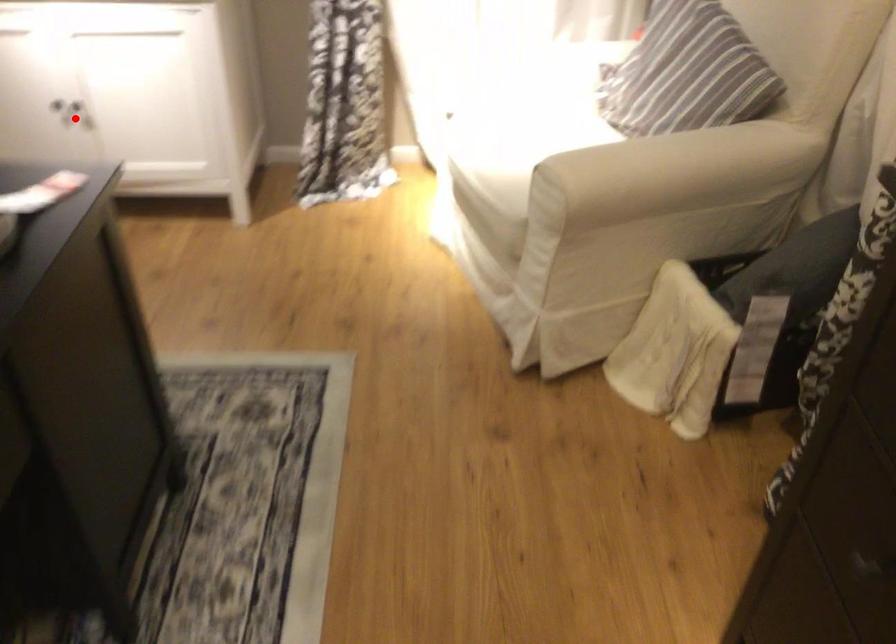
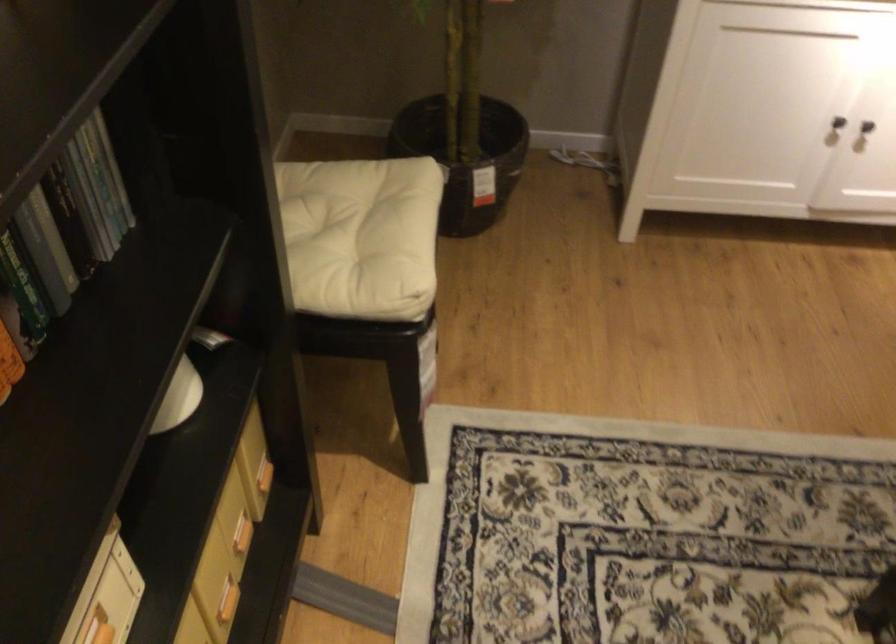
Question: I am providing you with two images of the same scene from different viewpoints. In image1, a red point is highlighted. Considering the same 3D point in image2, which of the following is correct?

Choices:
 (A) It is closer
 (B) It is farther

Answer: (A)